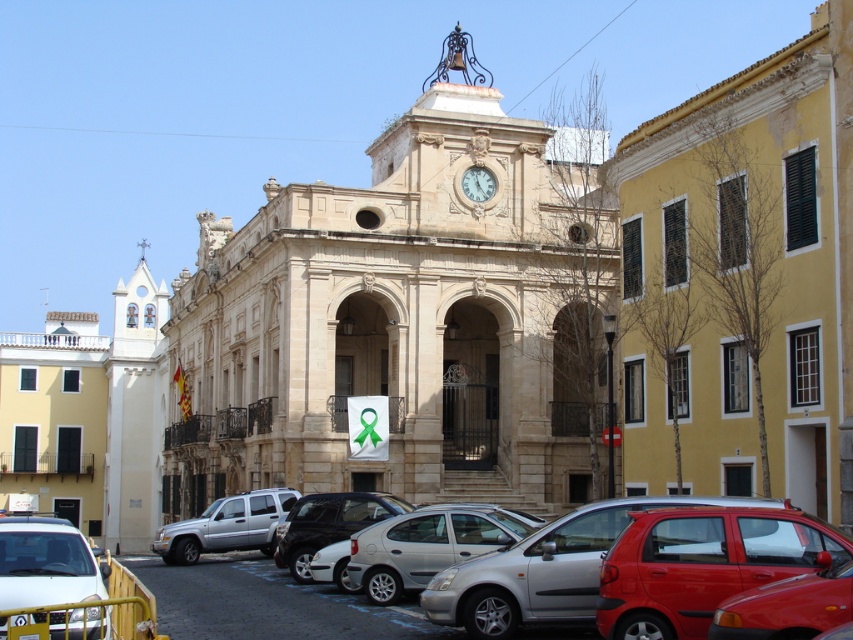
Question: Which of these objects is positioned closest to the yellow matte building at center?

Choices:
 (A) white marble clock at center
 (B) silver metallic hatchback at center
 (C) silver metallic suv at lower left

Answer: (A)

Question: Where is beige stone church at center located in relation to white marble clock at center in the image?

Choices:
 (A) above
 (B) below

Answer: (A)

Question: Is silver metallic hatchback at center smaller than white marble clock at center?

Choices:
 (A) yes
 (B) no

Answer: (B)

Question: Which is farther from the yellow matte building at center?

Choices:
 (A) beige stone church at center
 (B) silver metallic hatchback at center
 (C) white matte car at lower left
 (D) white marble clock at center

Answer: (C)

Question: Can you confirm if beige stone church at center is bigger than shiny red car at lower right?

Choices:
 (A) yes
 (B) no

Answer: (A)

Question: Which of the following is the closest to the observer?

Choices:
 (A) (19, 593)
 (B) (402, 630)
 (C) (822, 563)

Answer: (A)